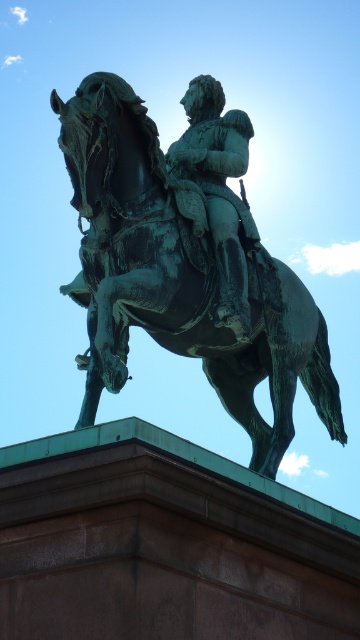
Question: Is green patina statue at center to the right of green patina armor at center from the viewer's perspective?

Choices:
 (A) yes
 (B) no

Answer: (B)

Question: Which point is farther to the camera?

Choices:
 (A) (300, 310)
 (B) (226, 289)

Answer: (A)

Question: Which object appears closest to the camera in this image?

Choices:
 (A) green patina armor at center
 (B) green patina statue at center

Answer: (B)

Question: Which object appears farthest from the camera in this image?

Choices:
 (A) green patina statue at center
 (B) green patina armor at center

Answer: (B)

Question: Is green patina statue at center to the right of green patina armor at center from the viewer's perspective?

Choices:
 (A) yes
 (B) no

Answer: (B)

Question: Is green patina statue at center smaller than green patina armor at center?

Choices:
 (A) yes
 (B) no

Answer: (B)